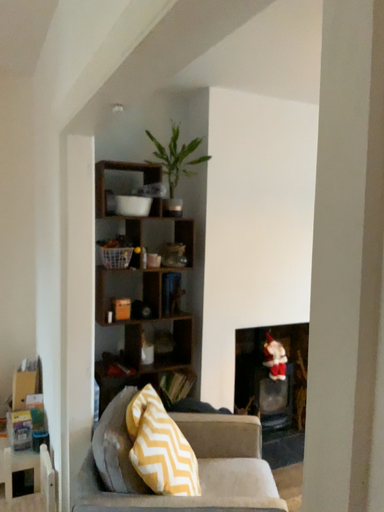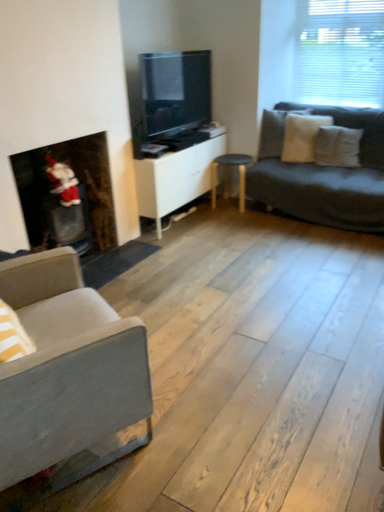
Question: How did the camera likely rotate when shooting the video?

Choices:
 (A) rotated right
 (B) rotated left

Answer: (A)